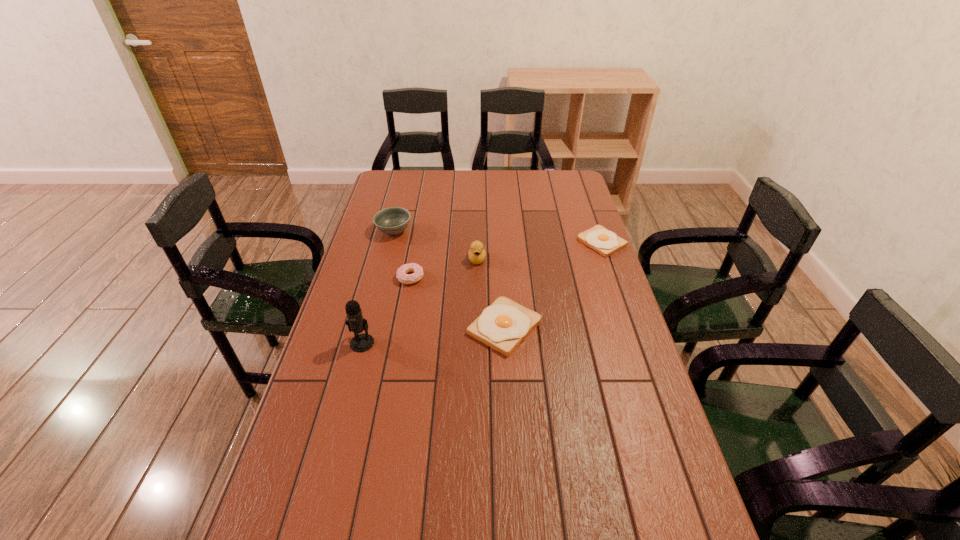
The height and width of the screenshot is (540, 960). What are the coordinates of `blank space at the far right corner of the desktop` in the screenshot? It's located at (575, 189).

The image size is (960, 540). Identify the location of empty location between the left toast and the fourth farthest object. (458, 302).

You are a GUI agent. You are given a task and a screenshot of the screen. Output one action in this format:
    pyautogui.click(x=<x>, y=<y>)
    Task: Click on the empty location between the fourth shortest object and the duckling
    
    Given the screenshot: What is the action you would take?
    pyautogui.click(x=436, y=245)

At what (x,y) coordinates should I click in order to perform the action: click on vacant region between the microphone and the doughnut. Please return your answer as a coordinate pair (x, y). The height and width of the screenshot is (540, 960). Looking at the image, I should click on (387, 310).

Where is `free space between the microphone and the shorter toast`? The width and height of the screenshot is (960, 540). free space between the microphone and the shorter toast is located at coordinates (482, 292).

What are the coordinates of `free area in between the microphone and the doughnut` in the screenshot? It's located at [x=387, y=310].

You are a GUI agent. You are given a task and a screenshot of the screen. Output one action in this format:
    pyautogui.click(x=<x>, y=<y>)
    Task: Click on the vacant area that lies between the microphone and the nearer toast
    
    Given the screenshot: What is the action you would take?
    pyautogui.click(x=433, y=335)

Locate an element on the screen. The image size is (960, 540). empty space between the third nearest object and the duckling is located at coordinates (444, 268).

You are a GUI agent. You are given a task and a screenshot of the screen. Output one action in this format:
    pyautogui.click(x=<x>, y=<y>)
    Task: Click on the vacant region between the bowl and the third nearest object
    This screenshot has height=540, width=960.
    Given the screenshot: What is the action you would take?
    pyautogui.click(x=402, y=254)

The width and height of the screenshot is (960, 540). I want to click on unoccupied position between the tallest object and the fourth farthest object, so click(x=387, y=310).